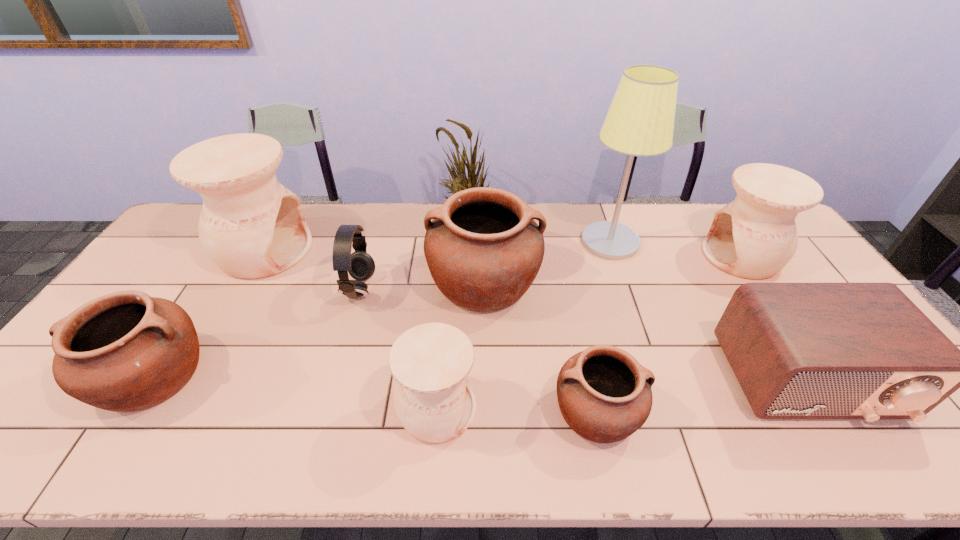
Locate an element on the screen. unoccupied area between the earphone and the radio receiver is located at coordinates (584, 335).

I want to click on object that stands as the eighth closest to the biggest reddish pottery, so click(x=755, y=236).

Choose which object is the nearest neighbor to the tallest pottery. Please provide its 2D coordinates. Your answer should be formatted as a tuple, i.e. [(x, y)], where the tuple contains the x and y coordinates of a point satisfying the conditions above.

[(360, 265)]

The image size is (960, 540). I want to click on pottery that is the closest to the nearest cream pottery, so click(483, 249).

Locate which pottery is the third closest to the smallest cream pottery. Please provide its 2D coordinates. Your answer should be formatted as a tuple, i.e. [(x, y)], where the tuple contains the x and y coordinates of a point satisfying the conditions above.

[(125, 351)]

I want to click on cream pottery that stands as the closest to the earphone, so click(251, 226).

I want to click on the closest cream pottery relative to the nearest cream pottery, so click(x=251, y=226).

Select which reddish pottery is the second closest to the leftmost reddish pottery. Please provide its 2D coordinates. Your answer should be formatted as a tuple, i.e. [(x, y)], where the tuple contains the x and y coordinates of a point satisfying the conditions above.

[(603, 393)]

Locate which reddish pottery is the third closest to the rightmost pottery. Please provide its 2D coordinates. Your answer should be formatted as a tuple, i.e. [(x, y)], where the tuple contains the x and y coordinates of a point satisfying the conditions above.

[(125, 351)]

At what (x,y) coordinates should I click in order to perform the action: click on free space that satisfies the following two spatial constraints: 1. at the open side of the rightmost cream pottery; 2. on the front panel of the radio receiver. Please return your answer as a coordinate pair (x, y). The image size is (960, 540). Looking at the image, I should click on (825, 381).